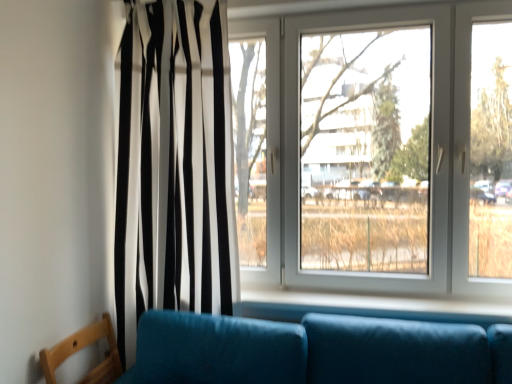
Question: Is white plastic window at center in front of wooden chair at lower left?

Choices:
 (A) no
 (B) yes

Answer: (A)

Question: Is white plastic window at center at the left side of wooden chair at lower left?

Choices:
 (A) no
 (B) yes

Answer: (A)

Question: Are white plastic window at center and wooden chair at lower left far apart?

Choices:
 (A) no
 (B) yes

Answer: (B)

Question: Considering the relative sizes of white plastic window at center and wooden chair at lower left in the image provided, is white plastic window at center taller than wooden chair at lower left?

Choices:
 (A) no
 (B) yes

Answer: (B)

Question: From a real-world perspective, is white plastic window at center over wooden chair at lower left?

Choices:
 (A) yes
 (B) no

Answer: (A)

Question: Is black/white striped curtain at left bigger or smaller than wooden chair at lower left?

Choices:
 (A) big
 (B) small

Answer: (A)

Question: From a real-world perspective, is black/white striped curtain at left positioned above or below wooden chair at lower left?

Choices:
 (A) above
 (B) below

Answer: (A)

Question: In terms of height, does black/white striped curtain at left look taller or shorter compared to wooden chair at lower left?

Choices:
 (A) short
 (B) tall

Answer: (B)

Question: Is point (220, 203) closer or farther from the camera than point (46, 375)?

Choices:
 (A) farther
 (B) closer

Answer: (A)

Question: Considering the positions of wooden chair at lower left and white plastic window at center in the image, is wooden chair at lower left bigger or smaller than white plastic window at center?

Choices:
 (A) big
 (B) small

Answer: (B)

Question: Is wooden chair at lower left wider or thinner than white plastic window at center?

Choices:
 (A) thin
 (B) wide

Answer: (A)

Question: Would you say wooden chair at lower left is inside or outside white plastic window at center?

Choices:
 (A) outside
 (B) inside

Answer: (A)

Question: Would you say wooden chair at lower left is to the left or to the right of white plastic window at center in the picture?

Choices:
 (A) left
 (B) right

Answer: (A)

Question: Visually, is black/white striped curtain at left positioned to the left or to the right of white smooth window sill at lower center?

Choices:
 (A) left
 (B) right

Answer: (A)

Question: Considering the positions of black/white striped curtain at left and white smooth window sill at lower center in the image, is black/white striped curtain at left taller or shorter than white smooth window sill at lower center?

Choices:
 (A) short
 (B) tall

Answer: (B)